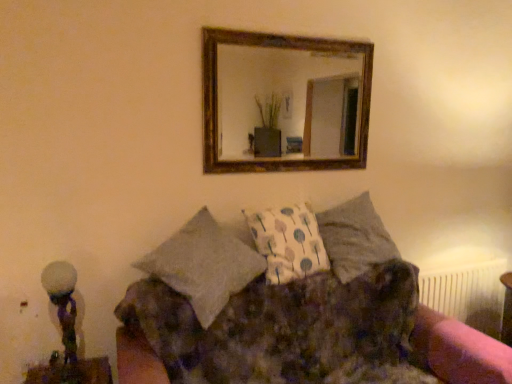
Describe the element at coordinates (293, 315) in the screenshot. I see `fluffy fabric couch at center` at that location.

Describe the element at coordinates (355, 237) in the screenshot. I see `textured gray pillow at center` at that location.

What is the approximate height of white frosted glass at left?

white frosted glass at left is 17.43 inches tall.

Image resolution: width=512 pixels, height=384 pixels. I want to click on wooden-framed mirror at upper center, so click(266, 89).

Find the location of a particular element. studio couch below the textured gray pillow at center (from a real-world perspective) is located at coordinates (293, 315).

Does textured gray pillow at center lie in front of fluffy fabric couch at center?

That is False.

From the image's perspective, is textured gray pillow at center located beneath fluffy fabric couch at center?

No, from the image's perspective, textured gray pillow at center is not below fluffy fabric couch at center.

Image resolution: width=512 pixels, height=384 pixels. In order to click on table lamp in front of the textured gray pillow at center in this screenshot , I will do coord(63,302).

From a real-world perspective, is textured gray pillow at center under white frosted glass at left?

No.

Based on the photo, does textured gray pillow at center turn towards white frosted glass at left?

No, textured gray pillow at center is not aimed at white frosted glass at left.

From a real-world perspective, which is physically below, textured gray pillow at center or white plastic radiator at lower right?

From a 3D spatial view, white plastic radiator at lower right is below.

Is textured gray pillow at center to the right of white plastic radiator at lower right from the viewer's perspective?

No.

Could you tell me if textured gray pillow at center is turned towards white plastic radiator at lower right?

No, textured gray pillow at center is not turned towards white plastic radiator at lower right.

Measure the distance between wooden-framed mirror at upper center and textured gray pillow at center.

A distance of 2.33 meters exists between wooden-framed mirror at upper center and textured gray pillow at center.

Does wooden-framed mirror at upper center turn towards textured gray pillow at center?

No, wooden-framed mirror at upper center is not oriented towards textured gray pillow at center.

Considering the positions of objects wooden-framed mirror at upper center and textured gray pillow at center in the image provided, who is in front, wooden-framed mirror at upper center or textured gray pillow at center?

wooden-framed mirror at upper center is more forward.

Which object is closer to the camera taking this photo, white frosted glass at left or wooden-framed mirror at upper center?

white frosted glass at left.

Is white frosted glass at left facing towards wooden-framed mirror at upper center?

No, white frosted glass at left is not oriented towards wooden-framed mirror at upper center.

Who is taller, white frosted glass at left or wooden-framed mirror at upper center?

Answer: With more height is wooden-framed mirror at upper center.

From a real-world perspective, is white frosted glass at left positioned above or below wooden-framed mirror at upper center?

From a real-world perspective, white frosted glass at left is physically below wooden-framed mirror at upper center.

Is wooden-framed mirror at upper center in contact with fluffy fabric couch at center?

No, wooden-framed mirror at upper center is not touching fluffy fabric couch at center.

Looking at this image, between wooden-framed mirror at upper center and fluffy fabric couch at center, which one has larger size?

fluffy fabric couch at center.

From the image's perspective, between wooden-framed mirror at upper center and fluffy fabric couch at center, which one is located above?

wooden-framed mirror at upper center appears higher in the image.

Which of these two, textured gray pillow at center or wooden-framed mirror at upper center, is smaller?

wooden-framed mirror at upper center.

Is textured gray pillow at center not near wooden-framed mirror at upper center?

Yes, textured gray pillow at center and wooden-framed mirror at upper center are located far from each other.

Is textured gray pillow at center further to the viewer compared to wooden-framed mirror at upper center?

Yes.

Considering the sizes of objects textured gray pillow at center and wooden-framed mirror at upper center in the image provided, who is shorter, textured gray pillow at center or wooden-framed mirror at upper center?

Standing shorter between the two is textured gray pillow at center.

You are a GUI agent. You are given a task and a screenshot of the screen. Output one action in this format:
    pyautogui.click(x=<x>, y=<y>)
    Task: Click on the studio couch on the left of textured gray pillow at center
    This screenshot has width=512, height=384.
    Given the screenshot: What is the action you would take?
    pyautogui.click(x=293, y=315)

Identify the location of table lamp below the textured gray pillow at center (from a real-world perspective). (63, 302).

Based on the photo, which object lies nearer to the anchor point wooden-framed mirror at upper center, white plastic radiator at lower right or white frosted glass at left?

white plastic radiator at lower right is closer to wooden-framed mirror at upper center.

Looking at the image, which one is located further to wooden-framed mirror at upper center, fluffy fabric couch at center or textured gray pillow at center?

The object further to wooden-framed mirror at upper center is fluffy fabric couch at center.

Looking at the image, which one is located further to wooden-framed mirror at upper center, fluffy fabric couch at center or white plastic radiator at lower right?

white plastic radiator at lower right lies further to wooden-framed mirror at upper center than the other object.

Looking at the image, which one is located further to white frosted glass at left, white plastic radiator at lower right or wooden-framed mirror at upper center?

Among the two, wooden-framed mirror at upper center is located further to white frosted glass at left.

Looking at the image, which one is located closer to wooden-framed mirror at upper center, white plastic radiator at lower right or textured gray pillow at center?

Among the two, textured gray pillow at center is located nearer to wooden-framed mirror at upper center.

Based on their spatial positions, is fluffy fabric couch at center or white frosted glass at left further from textured gray pillow at center?

Based on the image, white frosted glass at left appears to be further to textured gray pillow at center.

Looking at the image, which one is located further to white plastic radiator at lower right, fluffy fabric couch at center or wooden-framed mirror at upper center?

wooden-framed mirror at upper center is positioned further to the anchor white plastic radiator at lower right.

Looking at the image, which one is located further to white plastic radiator at lower right, white frosted glass at left or wooden-framed mirror at upper center?

wooden-framed mirror at upper center is further to white plastic radiator at lower right.

This screenshot has height=384, width=512. Identify the location of studio couch located between white frosted glass at left and white plastic radiator at lower right in the left-right direction. [x=293, y=315].

At what (x,y) coordinates should I click in order to perform the action: click on mirror located between white frosted glass at left and white plastic radiator at lower right in the left-right direction. Please return your answer as a coordinate pair (x, y). The width and height of the screenshot is (512, 384). Looking at the image, I should click on (266, 89).

Identify the location of table lamp between wooden-framed mirror at upper center and fluffy fabric couch at center in the vertical direction. (63, 302).

Where is `pillow between white frosted glass at left and white plastic radiator at lower right from left to right`? pillow between white frosted glass at left and white plastic radiator at lower right from left to right is located at coordinates (355, 237).